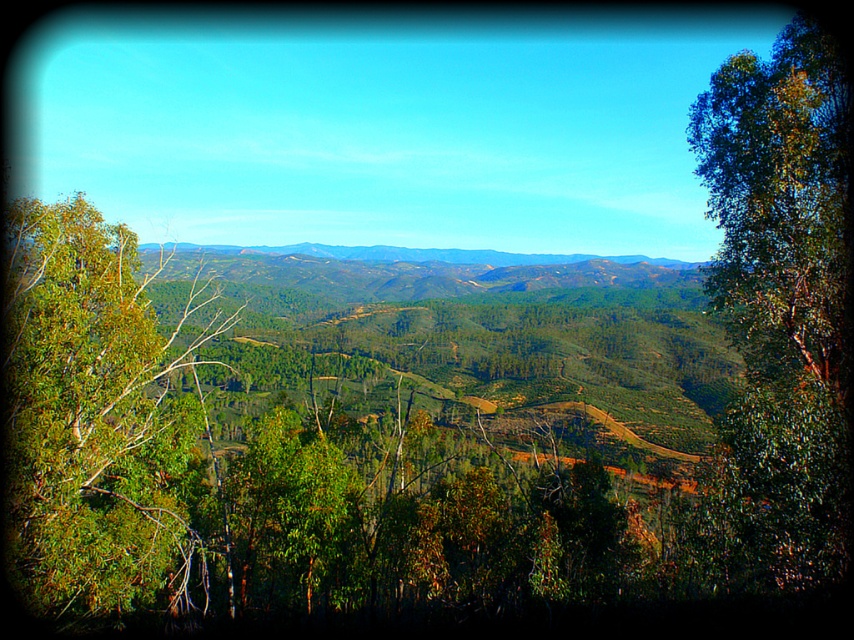
Based on the photo, you are standing in the middle of the forest and see the green leafy tree at right and the green leafy tree at left. Which tree is shorter?

The green leafy tree at right is shorter than the green leafy tree at left.

You are standing in the middle of the forest looking at the two green leafy trees. Which tree is closer to you, the green leafy tree at right or the green leafy tree at left?

The green leafy tree at right is closer to you because it is positioned in front of the green leafy tree at left.